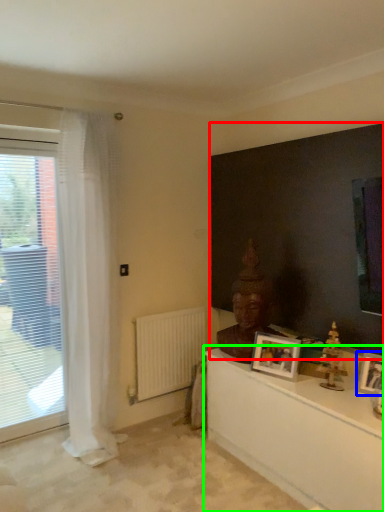
Question: Estimate the real-world distances between objects in this image. Which object is closer to backdrop (highlighted by a red box), picture frame (highlighted by a blue box) or table (highlighted by a green box)?

Choices:
 (A) picture frame
 (B) table

Answer: (A)